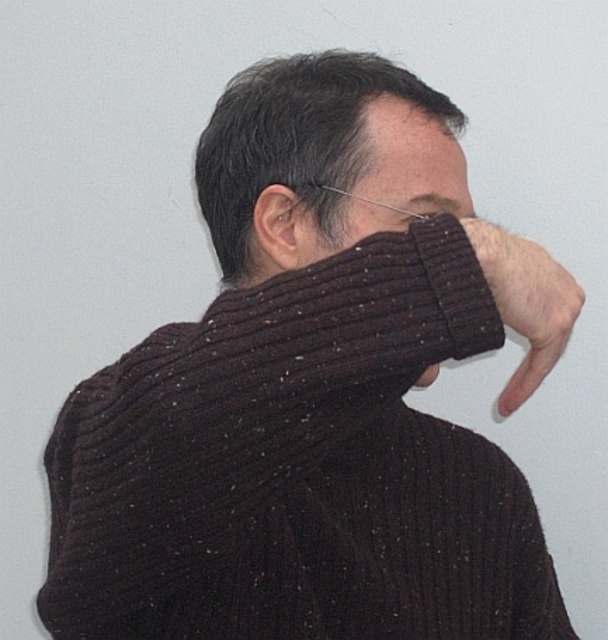
From the picture: Is matte brown hair at upper center closer to camera compared to matte black nose at center?

No, it is not.

Does point (412, 140) come farther from viewer compared to point (406, 227)?

That is True.

Between point (367, 170) and point (409, 216), which one is positioned behind?

Point (367, 170)

The image size is (608, 640). Find the location of `matte brown hair at upper center`. matte brown hair at upper center is located at coordinates (409, 150).

Describe the element at coordinates (525, 301) in the screenshot. This screenshot has width=608, height=640. I see `bare skin at center` at that location.

You are a GUI agent. You are given a task and a screenshot of the screen. Output one action in this format:
    pyautogui.click(x=<x>, y=<y>)
    Task: Click on the bare skin at center
    
    Given the screenshot: What is the action you would take?
    pyautogui.click(x=525, y=301)

You are a GUI agent. You are given a task and a screenshot of the screen. Output one action in this format:
    pyautogui.click(x=<x>, y=<y>)
    Task: Click on the bare skin at center
    
    Given the screenshot: What is the action you would take?
    pyautogui.click(x=525, y=301)

Which of these two, dark ribbed sweater at center or matte skin ear at center, stands shorter?

matte skin ear at center is shorter.

Does point (325, 54) come behind point (271, 268)?

Yes.

Find the location of a particular element. The width and height of the screenshot is (608, 640). dark ribbed sweater at center is located at coordinates (294, 138).